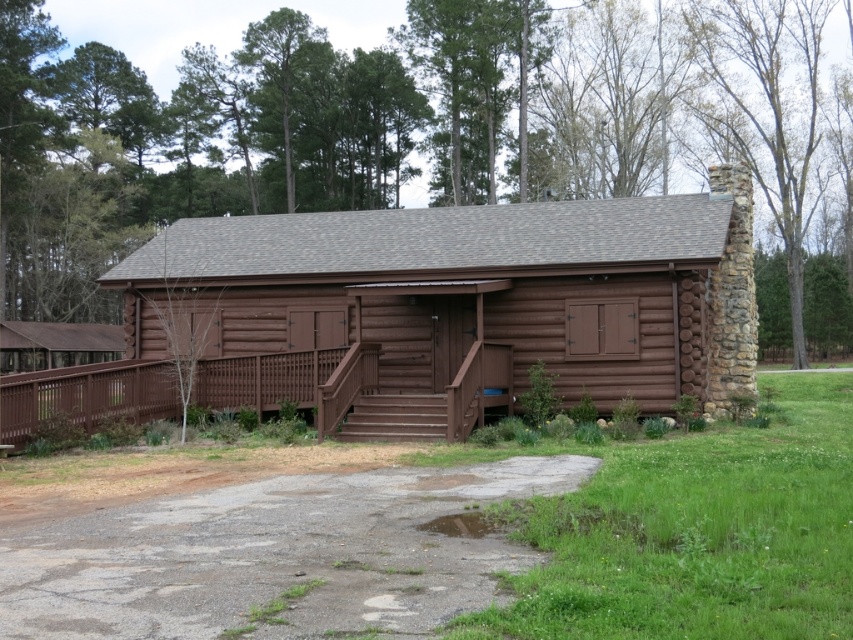
Is brown log cabin at center bigger than gray asphalt driveway at lower center?

Yes.

Which is more to the left, brown log cabin at center or gray asphalt driveway at lower center?

Positioned to the left is brown log cabin at center.

Identify the location of brown log cabin at center. This screenshot has width=853, height=640. (467, 301).

Can you confirm if brown log cabin at center is thinner than brown wood porch at center?

Incorrect, brown log cabin at center's width is not less than brown wood porch at center's.

Between brown log cabin at center and brown wood porch at center, which one has less height?

Standing shorter between the two is brown wood porch at center.

Is point (573, 276) closer to viewer compared to point (457, 412)?

No, (573, 276) is behind (457, 412).

At what (x,y) coordinates should I click in order to perform the action: click on brown log cabin at center. Please return your answer as a coordinate pair (x, y). Looking at the image, I should click on (467, 301).

Is gray asphalt driveway at lower center below brown wood porch at center?

Yes.

Locate an element on the screen. Image resolution: width=853 pixels, height=640 pixels. gray asphalt driveway at lower center is located at coordinates (274, 554).